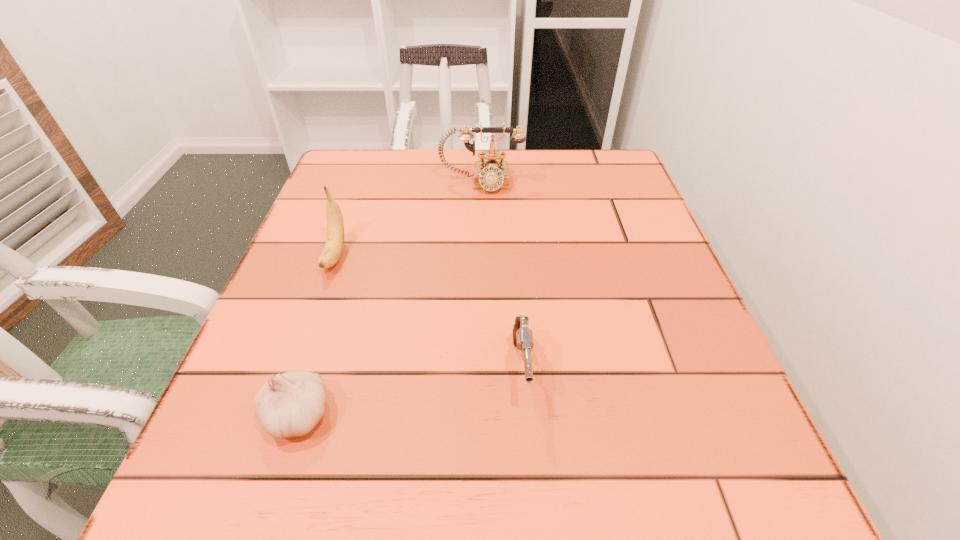
Locate an element on the screen. empty space that is in between the pistol and the second farthest object is located at coordinates (429, 312).

This screenshot has width=960, height=540. Identify the location of vacant area that lies between the garlic and the telephone. tap(390, 299).

Identify the location of vacant region between the garlic and the pistol. (410, 392).

Identify the location of free spot between the banana and the pistol. The height and width of the screenshot is (540, 960). (429, 312).

Locate an element on the screen. Image resolution: width=960 pixels, height=540 pixels. unoccupied position between the farthest object and the second farthest object is located at coordinates (408, 219).

Identify the location of vacant space that is in between the garlic and the farthest object. The height and width of the screenshot is (540, 960). (390, 299).

This screenshot has height=540, width=960. I want to click on free space between the third nearest object and the telephone, so click(408, 219).

At what (x,y) coordinates should I click in order to perform the action: click on object that ranks as the second closest to the pistol. Please return your answer as a coordinate pair (x, y). The image size is (960, 540). Looking at the image, I should click on (333, 248).

You are a GUI agent. You are given a task and a screenshot of the screen. Output one action in this format:
    pyautogui.click(x=<x>, y=<y>)
    Task: Click on the closest object to the farthest object
    
    Given the screenshot: What is the action you would take?
    pyautogui.click(x=333, y=248)

At what (x,y) coordinates should I click in order to perform the action: click on blank space that satisfies the following two spatial constraints: 1. at the start of the peel on the banana; 2. on the left side of the garlic. Please return your answer as a coordinate pair (x, y). This screenshot has width=960, height=540. Looking at the image, I should click on (278, 415).